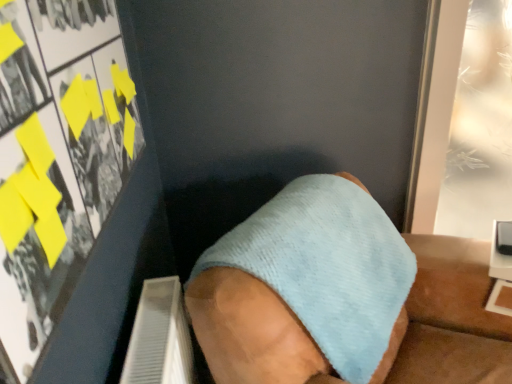
Describe the element at coordinates (56, 158) in the screenshot. I see `matte paper poster at upper left, arranged as the 1th poster page when viewed from the front` at that location.

Identify the location of matte paper poster at upper left, arranged as the 1th poster page when viewed from the front. The image size is (512, 384). (56, 158).

You are a GUI agent. You are given a task and a screenshot of the screen. Output one action in this format:
    pyautogui.click(x=<x>, y=<y>)
    Task: Click on the light blue fabric sock at center
    The image size is (512, 384).
    Given the screenshot: What is the action you would take?
    pyautogui.click(x=302, y=287)

Where is `transparent glass door at upper right, the first poster page positioned from the right`? Image resolution: width=512 pixels, height=384 pixels. transparent glass door at upper right, the first poster page positioned from the right is located at coordinates (480, 127).

Which is more to the right, matte paper poster at upper left, the first poster page positioned from the left, or light blue fabric sock at center?

From the viewer's perspective, light blue fabric sock at center appears more on the right side.

Find the location of a particular element. The height and width of the screenshot is (384, 512). poster page on the left of light blue fabric sock at center is located at coordinates (56, 158).

Is matte paper poster at upper left, the 2th poster page when ordered from back to front, oriented away from light blue fabric sock at center?

No, light blue fabric sock at center is not at the back of matte paper poster at upper left, the 2th poster page when ordered from back to front.

Is transparent glass door at upper right, placed as the 1th poster page when sorted from back to front, wider or thinner than light blue fabric sock at center?

Considering their sizes, transparent glass door at upper right, placed as the 1th poster page when sorted from back to front, looks slimmer than light blue fabric sock at center.

Who is shorter, transparent glass door at upper right, placed as the 1th poster page when sorted from back to front, or light blue fabric sock at center?

Standing shorter between the two is light blue fabric sock at center.

The image size is (512, 384). Identify the location of poster page that is the 2nd one when counting upward from the light blue fabric sock at center (from the image's perspective). (480, 127).

Considering the sizes of light blue fabric sock at center and transparent glass door at upper right, placed as the 1th poster page when sorted from back to front, in the image, is light blue fabric sock at center wider or thinner than transparent glass door at upper right, placed as the 1th poster page when sorted from back to front,?

Considering their sizes, light blue fabric sock at center looks broader than transparent glass door at upper right, placed as the 1th poster page when sorted from back to front.

Is light blue fabric sock at center oriented towards transparent glass door at upper right, placed as the 1th poster page when sorted from back to front?

No, light blue fabric sock at center is not facing towards transparent glass door at upper right, placed as the 1th poster page when sorted from back to front.

From a real-world perspective, which poster page is the 1st one above the light blue fabric sock at center? Please provide its 2D coordinates.

[(480, 127)]

Can you confirm if light blue fabric sock at center is positioned to the right of transparent glass door at upper right, placed as the 1th poster page when sorted from back to front?

Incorrect, light blue fabric sock at center is not on the right side of transparent glass door at upper right, placed as the 1th poster page when sorted from back to front.

Can you confirm if transparent glass door at upper right, the first poster page positioned from the right, is shorter than matte paper poster at upper left, positioned as the second poster page in right-to-left order?

No, transparent glass door at upper right, the first poster page positioned from the right, is not shorter than matte paper poster at upper left, positioned as the second poster page in right-to-left order.

Which of these two, transparent glass door at upper right, placed as the 2th poster page when sorted from front to back, or matte paper poster at upper left, the 2th poster page when ordered from back to front, is thinner?

matte paper poster at upper left, the 2th poster page when ordered from back to front.

From a real-world perspective, is transparent glass door at upper right, placed as the 1th poster page when sorted from back to front, under matte paper poster at upper left, the 2th poster page when ordered from back to front?

Indeed, from a real-world perspective, transparent glass door at upper right, placed as the 1th poster page when sorted from back to front, is positioned beneath matte paper poster at upper left, the 2th poster page when ordered from back to front.

Could you tell me if transparent glass door at upper right, the first poster page positioned from the right, is facing matte paper poster at upper left, the 2th poster page when ordered from back to front?

No, transparent glass door at upper right, the first poster page positioned from the right, does not turn towards matte paper poster at upper left, the 2th poster page when ordered from back to front.

Does light blue fabric sock at center appear on the left side of matte paper poster at upper left, the 2th poster page when ordered from back to front?

No.

How different are the orientations of light blue fabric sock at center and matte paper poster at upper left, arranged as the 1th poster page when viewed from the front, in degrees?

The facing directions of light blue fabric sock at center and matte paper poster at upper left, arranged as the 1th poster page when viewed from the front, are 37.5 degrees apart.

I want to click on footwear to the right of matte paper poster at upper left, arranged as the 1th poster page when viewed from the front, so click(302, 287).

Is light blue fabric sock at center positioned behind matte paper poster at upper left, the first poster page positioned from the left?

Yes, the depth of light blue fabric sock at center is greater than that of matte paper poster at upper left, the first poster page positioned from the left.

Is matte paper poster at upper left, the 2th poster page when ordered from back to front, not close to transparent glass door at upper right, placed as the 1th poster page when sorted from back to front?

matte paper poster at upper left, the 2th poster page when ordered from back to front, is far away from transparent glass door at upper right, placed as the 1th poster page when sorted from back to front.

Measure the distance between matte paper poster at upper left, positioned as the second poster page in right-to-left order, and transparent glass door at upper right, the 2th poster page when ordered from left to right.

A distance of 2.97 meters exists between matte paper poster at upper left, positioned as the second poster page in right-to-left order, and transparent glass door at upper right, the 2th poster page when ordered from left to right.

Locate an element on the screen. The image size is (512, 384). poster page behind the matte paper poster at upper left, positioned as the second poster page in right-to-left order is located at coordinates (480, 127).

Can you confirm if matte paper poster at upper left, positioned as the second poster page in right-to-left order, is shorter than transparent glass door at upper right, the first poster page positioned from the right?

Yes, matte paper poster at upper left, positioned as the second poster page in right-to-left order, is shorter than transparent glass door at upper right, the first poster page positioned from the right.

Where is `the 2nd poster page positioned above the light blue fabric sock at center (from a real-world perspective)`? This screenshot has width=512, height=384. the 2nd poster page positioned above the light blue fabric sock at center (from a real-world perspective) is located at coordinates (56, 158).

You are a GUI agent. You are given a task and a screenshot of the screen. Output one action in this format:
    pyautogui.click(x=<x>, y=<y>)
    Task: Click on the footwear that is on the left side of transparent glass door at upper right, placed as the 2th poster page when sorted from front to back
    The width and height of the screenshot is (512, 384).
    Given the screenshot: What is the action you would take?
    pyautogui.click(x=302, y=287)

Considering their positions, is matte paper poster at upper left, positioned as the second poster page in right-to-left order, positioned further to light blue fabric sock at center than transparent glass door at upper right, placed as the 1th poster page when sorted from back to front?

Based on the image, transparent glass door at upper right, placed as the 1th poster page when sorted from back to front, appears to be further to light blue fabric sock at center.

Considering their positions, is light blue fabric sock at center positioned further to transparent glass door at upper right, the first poster page positioned from the right, than matte paper poster at upper left, arranged as the 1th poster page when viewed from the front?

Among the two, matte paper poster at upper left, arranged as the 1th poster page when viewed from the front, is located further to transparent glass door at upper right, the first poster page positioned from the right.

Looking at the image, which one is located further to light blue fabric sock at center, transparent glass door at upper right, placed as the 2th poster page when sorted from front to back, or matte paper poster at upper left, arranged as the 1th poster page when viewed from the front?

transparent glass door at upper right, placed as the 2th poster page when sorted from front to back.

From the picture: Which object lies nearer to the anchor point transparent glass door at upper right, placed as the 1th poster page when sorted from back to front, matte paper poster at upper left, arranged as the 1th poster page when viewed from the front, or light blue fabric sock at center?

Based on the image, light blue fabric sock at center appears to be nearer to transparent glass door at upper right, placed as the 1th poster page when sorted from back to front.

Based on the photo, estimate the real-world distances between objects in this image. Which object is closer to matte paper poster at upper left, positioned as the second poster page in right-to-left order, light blue fabric sock at center or transparent glass door at upper right, placed as the 2th poster page when sorted from front to back?

light blue fabric sock at center is positioned closer to the anchor matte paper poster at upper left, positioned as the second poster page in right-to-left order.

From the image, which object appears to be farther from matte paper poster at upper left, positioned as the second poster page in right-to-left order, transparent glass door at upper right, placed as the 2th poster page when sorted from front to back, or light blue fabric sock at center?

Based on the image, transparent glass door at upper right, placed as the 2th poster page when sorted from front to back, appears to be further to matte paper poster at upper left, positioned as the second poster page in right-to-left order.

At what (x,y) coordinates should I click in order to perform the action: click on footwear located between matte paper poster at upper left, arranged as the 1th poster page when viewed from the front, and transparent glass door at upper right, placed as the 1th poster page when sorted from back to front, in the left-right direction. Please return your answer as a coordinate pair (x, y). The image size is (512, 384). Looking at the image, I should click on (302, 287).